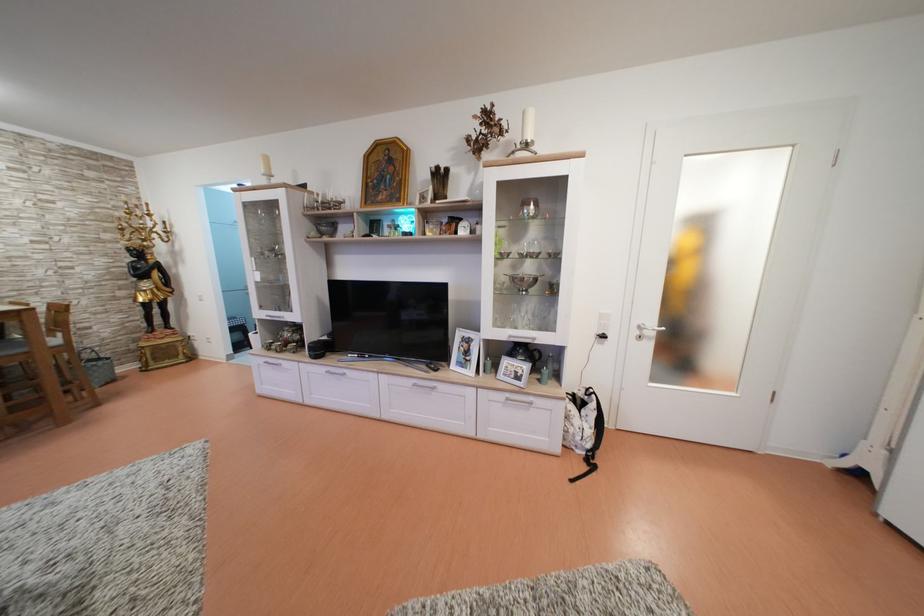
This screenshot has height=616, width=924. Identify the location of silver door handle. (647, 331).